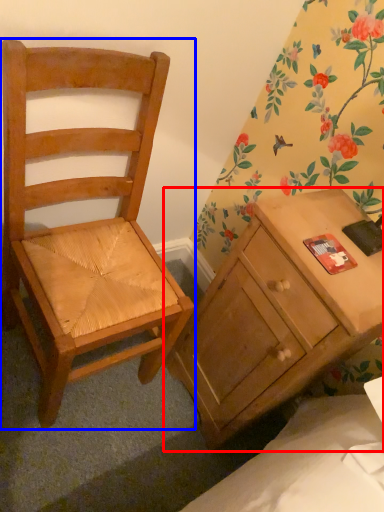
Question: Which of the following is the farthest to the observer, desk (highlighted by a red box) or chair (highlighted by a blue box)?

Choices:
 (A) desk
 (B) chair

Answer: (A)